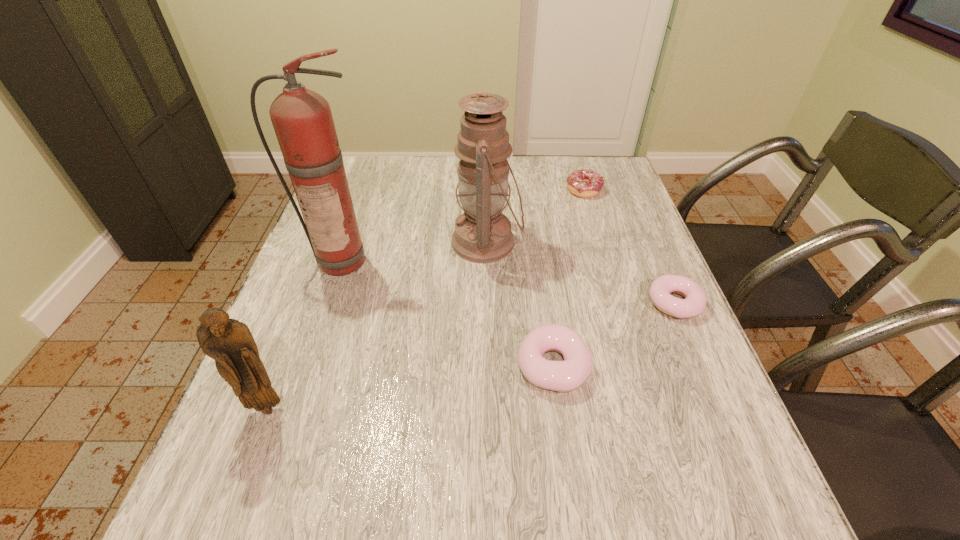
Observe the arrangement of all doughnuts in the image. To keep them evenly spaced, where would you place another doughnut on the left? Please locate a free space. Please provide its 2D coordinates. Your answer should be formatted as a tuple, i.e. [(x, y)], where the tuple contains the x and y coordinates of a point satisfying the conditions above.

[(392, 448)]